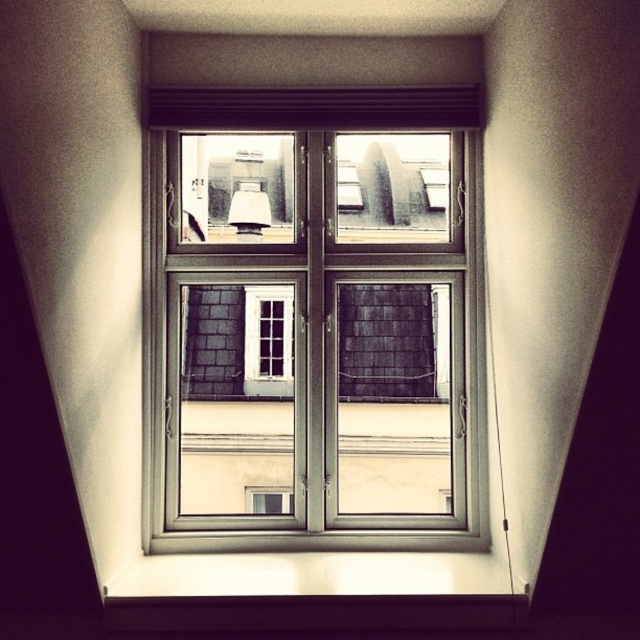
Is metallic silver window at center shorter than matte white lampshade at upper center?

In fact, metallic silver window at center may be taller than matte white lampshade at upper center.

Can you confirm if metallic silver window at center is taller than matte white lampshade at upper center?

Yes, metallic silver window at center is taller than matte white lampshade at upper center.

Identify the location of metallic silver window at center. (316, 321).

This screenshot has width=640, height=640. Identify the location of metallic silver window at center. (316, 321).